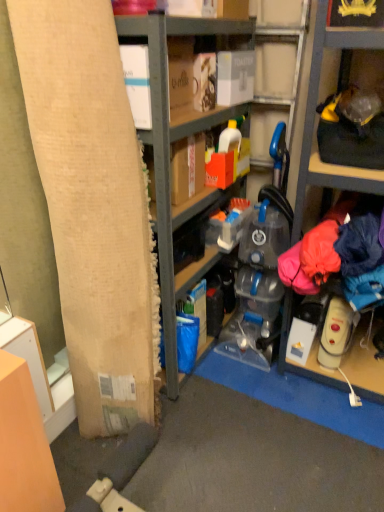
The height and width of the screenshot is (512, 384). What do you see at coordinates (170, 149) in the screenshot?
I see `cardboard box at center` at bounding box center [170, 149].

Find the location of a particular element. The height and width of the screenshot is (512, 384). cardboard box at center is located at coordinates (170, 149).

You are a GUI agent. You are given a task and a screenshot of the screen. Output one action in this format:
    pyautogui.click(x=<x>, y=<y>)
    Task: Click on the cardboard box at center
    This screenshot has height=512, width=384.
    Given the screenshot: What is the action you would take?
    pyautogui.click(x=170, y=149)